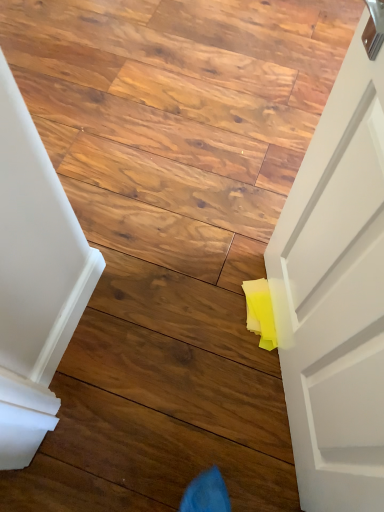
Identify the location of free spot below smooth wood plank at center (from a real-world perspective). (139, 470).